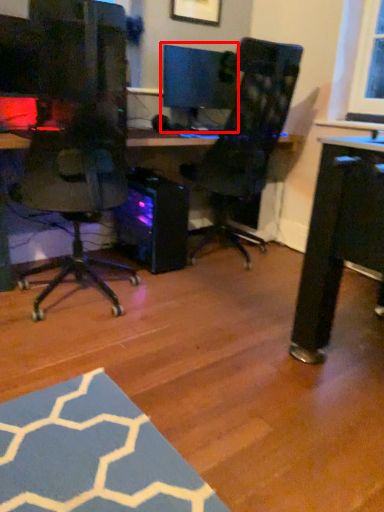
Question: In this image, where is computer monitor (annotated by the red box) located relative to computer tower?

Choices:
 (A) left
 (B) right

Answer: (B)